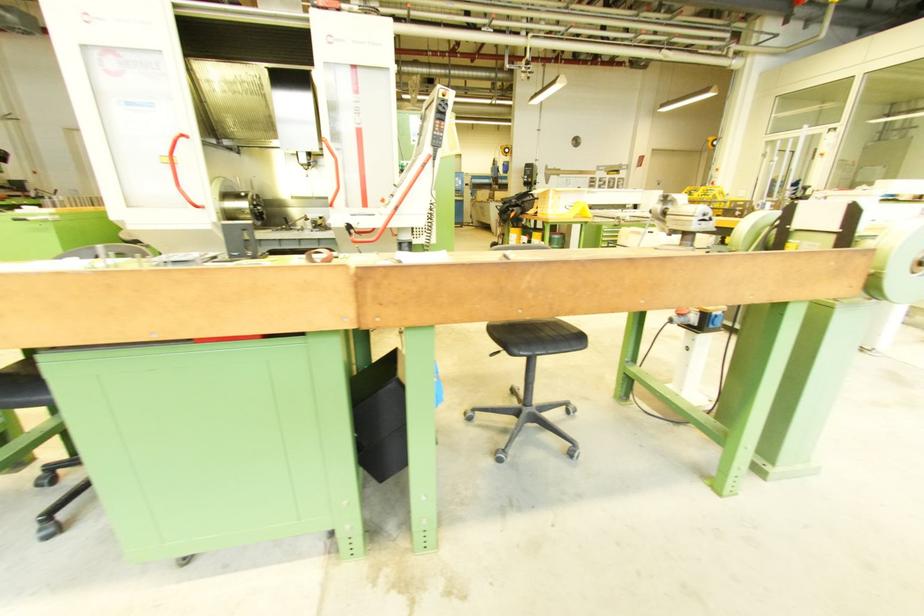
This screenshot has height=616, width=924. I want to click on metal vise handle, so click(359, 136).